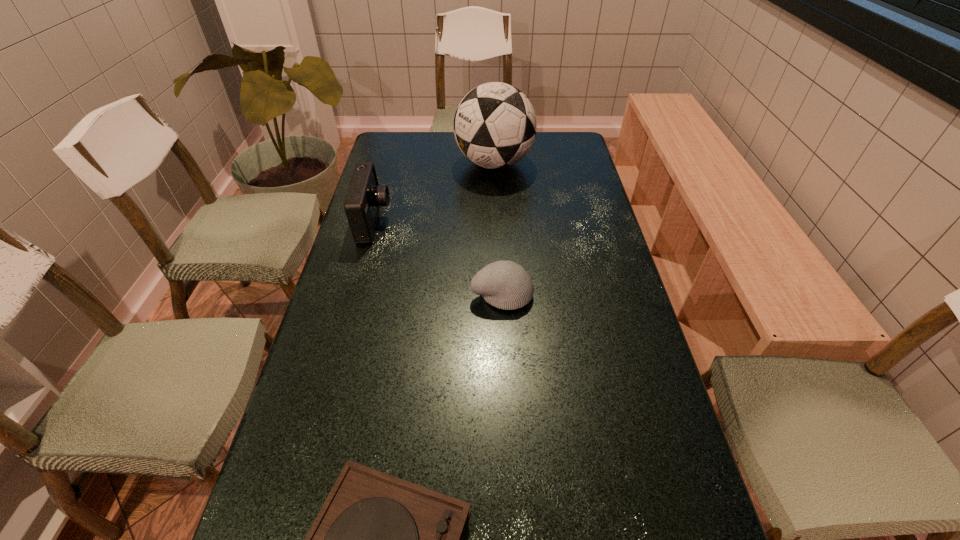
The height and width of the screenshot is (540, 960). In order to click on the farthest object in this screenshot , I will do `click(495, 125)`.

Identify the location of soccer ball. Image resolution: width=960 pixels, height=540 pixels. (495, 125).

This screenshot has width=960, height=540. Find the location of `camera`. camera is located at coordinates (364, 198).

Find the location of a particular element. the third shortest object is located at coordinates (364, 198).

This screenshot has width=960, height=540. Identify the location of the third tallest object. (506, 285).

You are a GUI agent. You are given a task and a screenshot of the screen. Output one action in this format:
    pyautogui.click(x=<x>, y=<y>)
    Task: Click on the beanie
    Image resolution: width=960 pixels, height=540 pixels.
    Given the screenshot: What is the action you would take?
    pyautogui.click(x=506, y=285)

The height and width of the screenshot is (540, 960). I want to click on vacant space located 0.060m on the surface of the soccer ball where the brand logo is visible, so click(x=439, y=164).

Identify the location of free region located on the surface of the soccer ball where the brand logo is visible. Image resolution: width=960 pixels, height=540 pixels. (391, 164).

This screenshot has width=960, height=540. Find the location of `blank area located 0.140m on the surface of the soccer ball where the brand logo is visible`. blank area located 0.140m on the surface of the soccer ball where the brand logo is visible is located at coordinates (418, 164).

This screenshot has height=540, width=960. In order to click on vacant space located 0.370m on the front-facing side of the second farthest object in this screenshot , I will do `click(507, 222)`.